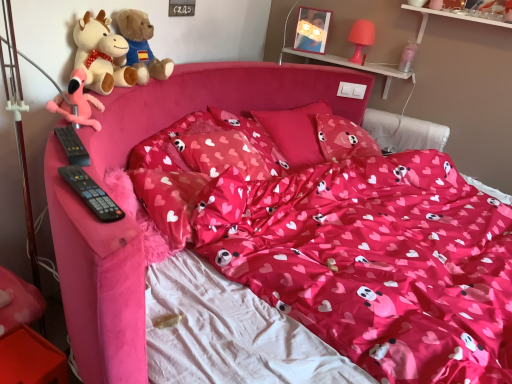
The image size is (512, 384). Identify the location of matte pink pillow at center, the 3th pillow in the back-to-front sequence. (224, 154).

The image size is (512, 384). I want to click on wooden picture frame at upper center, so click(x=312, y=30).

What do you see at coordinates (312, 30) in the screenshot?
I see `wooden picture frame at upper center` at bounding box center [312, 30].

Image resolution: width=512 pixels, height=384 pixels. Identify the location of matte pink pillow at center, the first pillow positioned from the front. (169, 201).

Considering the relative positions of matte pink pillow at center, the first pillow positioned from the front, and clear plastic bottle at upper right, placed as the second toy when sorted from bottom to top, in the image provided, is matte pink pillow at center, the first pillow positioned from the front, to the right of clear plastic bottle at upper right, placed as the second toy when sorted from bottom to top, from the viewer's perspective?

No, matte pink pillow at center, the first pillow positioned from the front, is not to the right of clear plastic bottle at upper right, placed as the second toy when sorted from bottom to top.

Considering the positions of objects matte pink pillow at center, which is counted as the 4th pillow, starting from the back, and clear plastic bottle at upper right, marked as the 2th toy in a left-to-right arrangement, in the image provided, who is behind, matte pink pillow at center, which is counted as the 4th pillow, starting from the back, or clear plastic bottle at upper right, marked as the 2th toy in a left-to-right arrangement,?

Positioned behind is clear plastic bottle at upper right, marked as the 2th toy in a left-to-right arrangement.

Between matte pink pillow at center, which is counted as the 4th pillow, starting from the back, and clear plastic bottle at upper right, the first toy when ordered from right to left, which one has less height?

clear plastic bottle at upper right, the first toy when ordered from right to left.

Consider the image. Is matte pink pillow at center, which is counted as the 4th pillow, starting from the back, aimed at clear plastic bottle at upper right, the first toy when ordered from right to left?

No.

From a real-world perspective, is matte pink pillow at center, which ranks as the first pillow in back-to-front order, below wooden picture frame at upper center?

Yes.

Is matte pink pillow at center, placed as the 4th pillow when sorted from front to back, oriented towards wooden picture frame at upper center?

No.

Is matte pink pillow at center, placed as the 4th pillow when sorted from front to back, positioned beyond the bounds of wooden picture frame at upper center?

Yes.

Between matte pink pillow at center, which ranks as the first pillow in back-to-front order, and wooden picture frame at upper center, which one has smaller size?

wooden picture frame at upper center.

From a real-world perspective, which is physically above, black plastic remote control at left, acting as the second remote control starting from the bottom, or shiny pink fabric at center?

From a 3D spatial view, black plastic remote control at left, acting as the second remote control starting from the bottom, is above.

Considering the sizes of black plastic remote control at left, placed as the 2th remote control when sorted from front to back, and shiny pink fabric at center in the image, is black plastic remote control at left, placed as the 2th remote control when sorted from front to back, taller or shorter than shiny pink fabric at center?

In the image, black plastic remote control at left, placed as the 2th remote control when sorted from front to back, appears to be shorter than shiny pink fabric at center.

Can we say black plastic remote control at left, placed as the 2th remote control when sorted from front to back, lies outside shiny pink fabric at center?

That's correct, black plastic remote control at left, placed as the 2th remote control when sorted from front to back, is outside of shiny pink fabric at center.

Consider the image. Which object is closer to the camera taking this photo, black plastic remote control at left, acting as the second remote control starting from the bottom, or shiny pink fabric at center?

shiny pink fabric at center.

Considering the relative positions of pink fabric pillow at center, which is the third pillow in front-to-back order, and wooden picture frame at upper center in the image provided, is pink fabric pillow at center, which is the third pillow in front-to-back order, to the left or to the right of wooden picture frame at upper center?

Clearly, pink fabric pillow at center, which is the third pillow in front-to-back order, is on the left of wooden picture frame at upper center in the image.

Which is behind, point (271, 136) or point (298, 43)?

Point (298, 43)

Does pink fabric pillow at center, the 2th pillow from the back, contain wooden picture frame at upper center?

No, pink fabric pillow at center, the 2th pillow from the back, does not contain wooden picture frame at upper center.

In the scene shown: Considering the sizes of shiny pink fabric at center and fluffy pink flamingo at left, the 2th toy in the back-to-front sequence, in the image, is shiny pink fabric at center wider or thinner than fluffy pink flamingo at left, the 2th toy in the back-to-front sequence,?

shiny pink fabric at center is wider than fluffy pink flamingo at left, the 2th toy in the back-to-front sequence.

Would you say shiny pink fabric at center contains fluffy pink flamingo at left, the 2th toy viewed from the right?

Definitely not — fluffy pink flamingo at left, the 2th toy viewed from the right, is not inside shiny pink fabric at center.

Looking at this image, considering the positions of objects shiny pink fabric at center and fluffy pink flamingo at left, marked as the first toy in a front-to-back arrangement, in the image provided, who is more to the left, shiny pink fabric at center or fluffy pink flamingo at left, marked as the first toy in a front-to-back arrangement,?

Positioned to the left is fluffy pink flamingo at left, marked as the first toy in a front-to-back arrangement.

Who is smaller, matte pink pillow at center, placed as the 4th pillow when sorted from front to back, or pink fabric pillow at center, which is the third pillow in front-to-back order?

matte pink pillow at center, placed as the 4th pillow when sorted from front to back.

Could you tell me if matte pink pillow at center, which ranks as the first pillow in back-to-front order, is facing pink fabric pillow at center, the 2th pillow from the back?

Yes, matte pink pillow at center, which ranks as the first pillow in back-to-front order, is facing pink fabric pillow at center, the 2th pillow from the back.

Can you confirm if matte pink pillow at center, placed as the 4th pillow when sorted from front to back, is shorter than pink fabric pillow at center, which is the third pillow in front-to-back order?

Indeed, matte pink pillow at center, placed as the 4th pillow when sorted from front to back, has a lesser height compared to pink fabric pillow at center, which is the third pillow in front-to-back order.

From a real-world perspective, is matte pink pillow at center, which ranks as the first pillow in back-to-front order, above or below pink fabric pillow at center, the 2th pillow from the back?

Clearly, from a real-world perspective, matte pink pillow at center, which ranks as the first pillow in back-to-front order, is below pink fabric pillow at center, the 2th pillow from the back.

Could you tell me if matte pink pillow at center, which is counted as the 4th pillow, starting from the back, is turned towards soft plush teddy bear at upper left, placed as the second teddy bear when sorted from front to back?

No, matte pink pillow at center, which is counted as the 4th pillow, starting from the back, does not turn towards soft plush teddy bear at upper left, placed as the second teddy bear when sorted from front to back.

Is matte pink pillow at center, which is counted as the 4th pillow, starting from the back, not within soft plush teddy bear at upper left, the 1th teddy bear in the back-to-front sequence?

Indeed, matte pink pillow at center, which is counted as the 4th pillow, starting from the back, is completely outside soft plush teddy bear at upper left, the 1th teddy bear in the back-to-front sequence.

Considering the positions of point (156, 209) and point (140, 38), is point (156, 209) closer or farther from the camera than point (140, 38)?

Clearly, point (156, 209) is closer to the camera than point (140, 38).

The height and width of the screenshot is (384, 512). There is a clear plastic bottle at upper right, the first toy positioned from the top. What are the coordinates of `the 3rd pillow below it (from a real-world perspective)` in the screenshot? It's located at (169, 201).

Find the location of a particular element. The width and height of the screenshot is (512, 384). picture frame lying above the matte pink pillow at center, which ranks as the first pillow in back-to-front order (from the image's perspective) is located at coordinates (312, 30).

Considering their positions, is soft plush teddy bear at upper left, the second teddy bear positioned from the back, positioned further to matte pink pillow at center, which ranks as the first pillow in back-to-front order, than black plastic remote control at left, acting as the first remote control starting from the back?

The object further to matte pink pillow at center, which ranks as the first pillow in back-to-front order, is black plastic remote control at left, acting as the first remote control starting from the back.

Based on their spatial positions, is wooden picture frame at upper center or fluffy pink flamingo at left, which is the first toy from left to right, closer to pink fabric pillow at center, the 2th pillow from the back?

wooden picture frame at upper center lies closer to pink fabric pillow at center, the 2th pillow from the back, than the other object.

From the image, which object appears to be farther from fluffy pink flamingo at left, which appears as the 2th toy when viewed from the top, soft plush teddy bear at upper left, the 1th teddy bear in the back-to-front sequence, or matte pink pillow at center, which is counted as the 4th pillow, starting from the back?

Among the two, matte pink pillow at center, which is counted as the 4th pillow, starting from the back, is located further to fluffy pink flamingo at left, which appears as the 2th toy when viewed from the top.

From the image, which object appears to be farther from fluffy pink flamingo at left, which is the first toy from left to right, soft plush teddy bear at upper left, the second teddy bear positioned from the back, or clear plastic bottle at upper right, placed as the second toy when sorted from bottom to top?

clear plastic bottle at upper right, placed as the second toy when sorted from bottom to top.

Based on their spatial positions, is fluffy pink flamingo at left, which is the first toy from bottom to top, or black plastic remote control at left, the 1th remote control viewed from the front, further from soft plush teddy bear at upper left, the second teddy bear positioned from the back?

The object further to soft plush teddy bear at upper left, the second teddy bear positioned from the back, is black plastic remote control at left, the 1th remote control viewed from the front.

When comparing their distances from clear plastic bottle at upper right, the first toy when ordered from right to left, does shiny pink fabric at center or soft plush teddy bear at upper left, the first teddy bear from the front, seem closer?

shiny pink fabric at center lies closer to clear plastic bottle at upper right, the first toy when ordered from right to left, than the other object.

Looking at the image, which one is located closer to shiny pink fabric at center, matte pink pillow at center, which is counted as the 4th pillow, starting from the back, or matte pink pillow at center, the 3th pillow in the back-to-front sequence?

matte pink pillow at center, the 3th pillow in the back-to-front sequence, is positioned closer to the anchor shiny pink fabric at center.

Looking at the image, which one is located closer to soft plush teddy bear at upper left, the second teddy bear positioned from the back, shiny pink fabric at center or matte pink pillow at center, placed as the 4th pillow when sorted from front to back?

shiny pink fabric at center is closer to soft plush teddy bear at upper left, the second teddy bear positioned from the back.

At what (x,y) coordinates should I click in order to perform the action: click on toy between black plastic remote control at left, which is counted as the 1th remote control, starting from the bottom, and soft plush teddy bear at upper left, the second teddy bear positioned from the back, in the front-back direction. Please return your answer as a coordinate pair (x, y). Looking at the image, I should click on (77, 102).

Find the location of a particular element. This screenshot has height=384, width=512. teddy bear positioned between black plastic remote control at left, positioned as the first remote control in top-to-bottom order, and soft plush teddy bear at upper left, the 1th teddy bear in the back-to-front sequence, from near to far is located at coordinates (101, 54).

Where is `teddy bear situated between fluffy pink flamingo at left, which is the first toy from bottom to top, and shiny pink fabric at center from left to right`? teddy bear situated between fluffy pink flamingo at left, which is the first toy from bottom to top, and shiny pink fabric at center from left to right is located at coordinates (141, 47).

Identify the location of teddy bear positioned between matte pink pillow at center, which is counted as the 4th pillow, starting from the back, and pink fabric pillow at center, the 2th pillow from the back, from near to far. [141, 47].